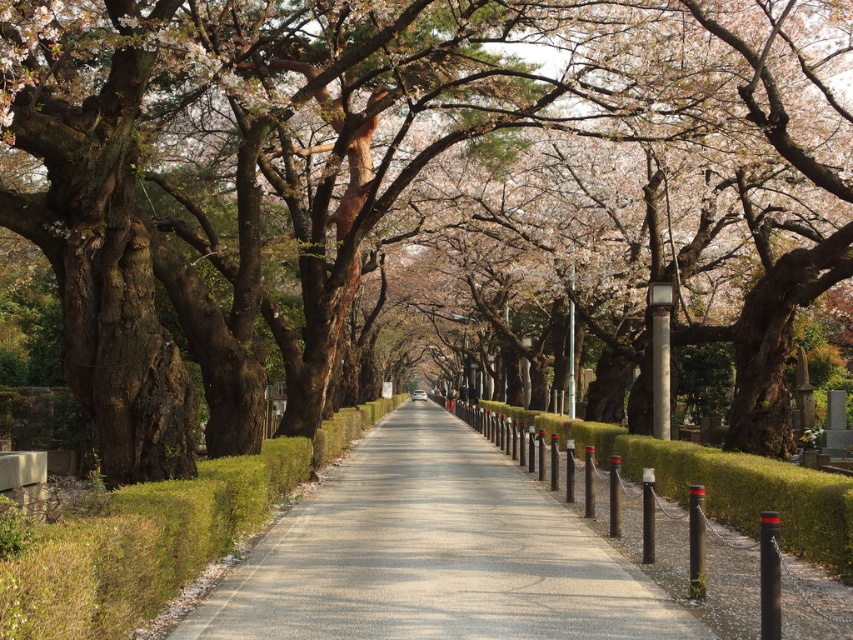
Does smooth concrete pavement at center have a larger size compared to green grassy hedge at center?

Indeed, smooth concrete pavement at center has a larger size compared to green grassy hedge at center.

Find the location of `smooth concrete pavement at center`. smooth concrete pavement at center is located at coordinates (433, 554).

What are the coordinates of `smooth concrete pavement at center` in the screenshot? It's located at (433, 554).